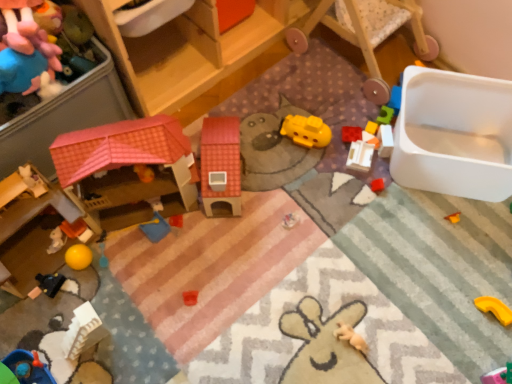
Image resolution: width=512 pixels, height=384 pixels. I want to click on vacant area that lies between yellow rubber toy at lower right, which ranks as the 1th toy in right-to-left order, and yellow matte block at upper right, the ninth toy when ordered from left to right, so click(442, 238).